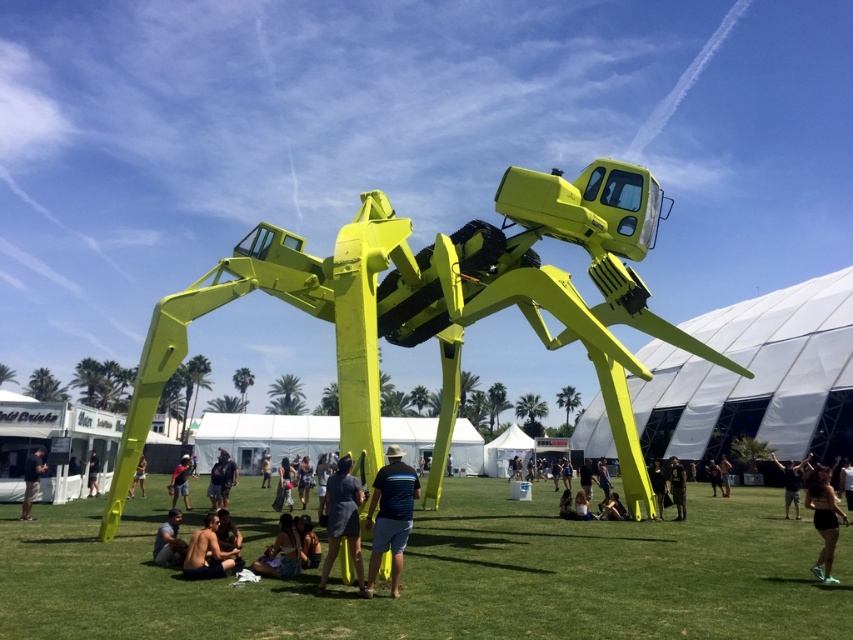
Question: Which point is farther to the camera?

Choices:
 (A) (653, 476)
 (B) (345, 493)
 (C) (186, 499)

Answer: (C)

Question: Which of the following is the closest to the observer?

Choices:
 (A) matte black shirt at center
 (B) black matte shorts at lower right
 (C) dark brown leather jacket at center

Answer: (B)

Question: Which of these objects is positioned farthest from the dark blue shirt at lower left?

Choices:
 (A) matte black person at lower center
 (B) black matte shirt at center
 (C) light brown leather jacket at center
 (D) blue striped shirt at center

Answer: (B)

Question: Observing the image, what is the correct spatial positioning of matte black shorts at center in reference to black fabric pants at center?

Choices:
 (A) right
 (B) left

Answer: (B)

Question: From the image, what is the correct spatial relationship of matte black shirt at center in relation to black fabric pants at center?

Choices:
 (A) above
 (B) below

Answer: (A)

Question: Does matte black shorts at center appear under light brown leather jacket at center?

Choices:
 (A) yes
 (B) no

Answer: (B)